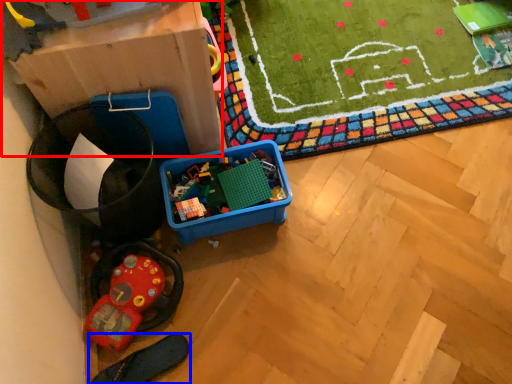
Question: Which point is closer to the camera, cardboard box (highlighted by a red box) or footwear (highlighted by a blue box)?

Choices:
 (A) cardboard box
 (B) footwear

Answer: (A)